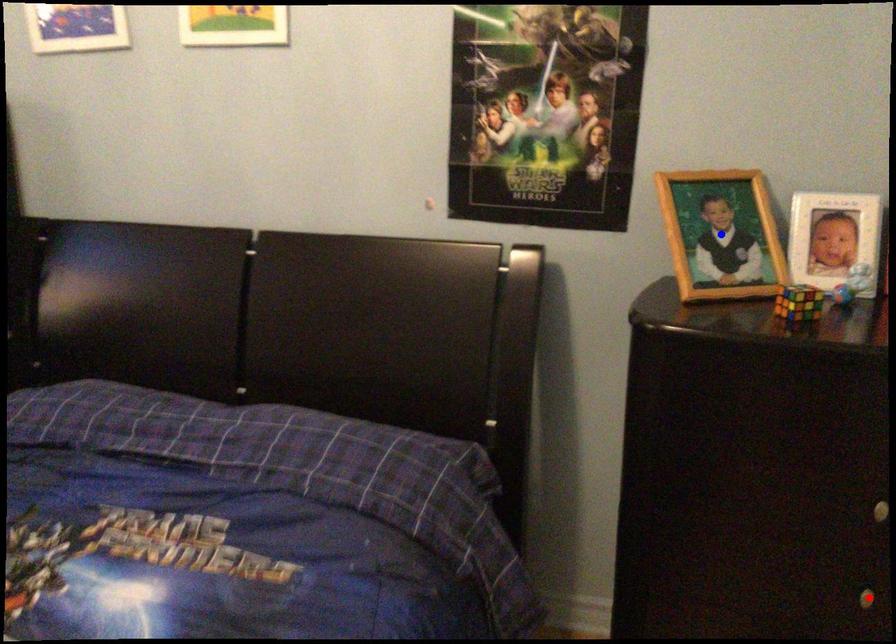
Question: Two points are marked on the image. Which point is closer to the camera?

Choices:
 (A) Blue point is closer.
 (B) Red point is closer.

Answer: (B)